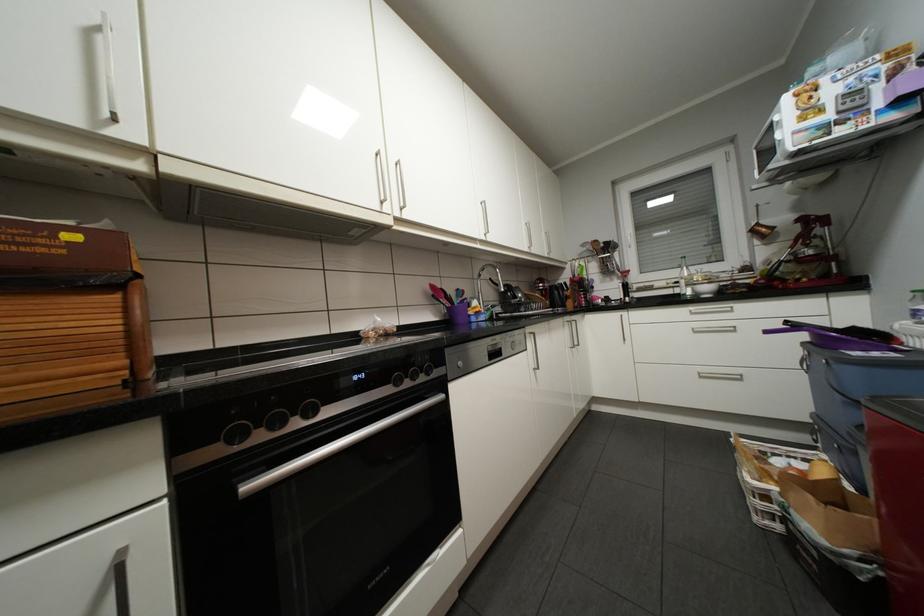
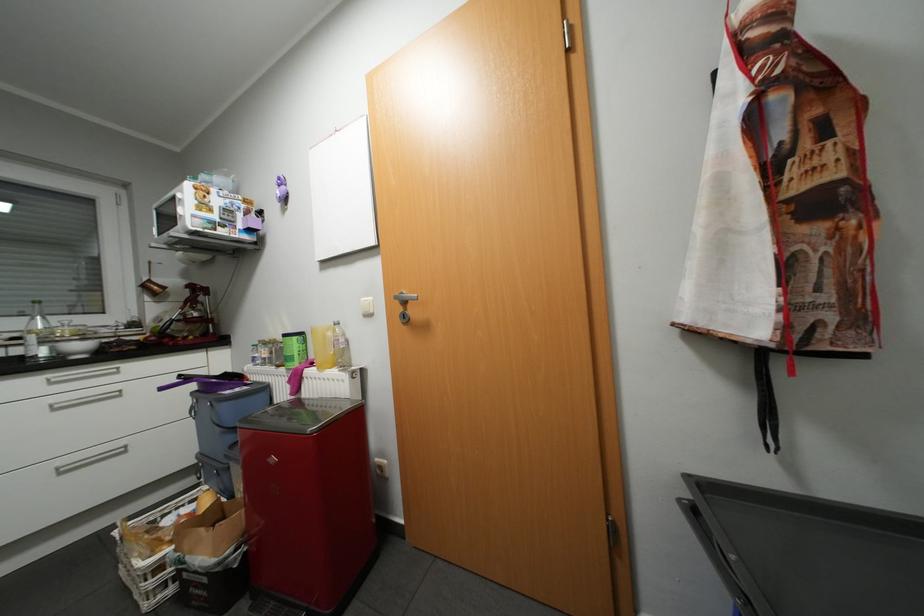
The point at (687, 294) is marked in the first image. Where is the corresponding point in the second image?

(30, 357)